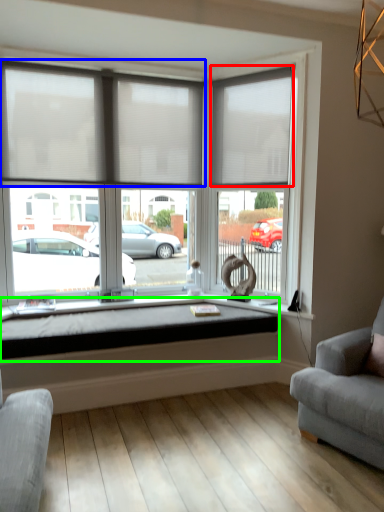
Question: Considering the real-world distances, which object is farthest from window blind (highlighted by a red box)? window blind (highlighted by a blue box) or window sill (highlighted by a green box)?

Choices:
 (A) window blind
 (B) window sill

Answer: (B)